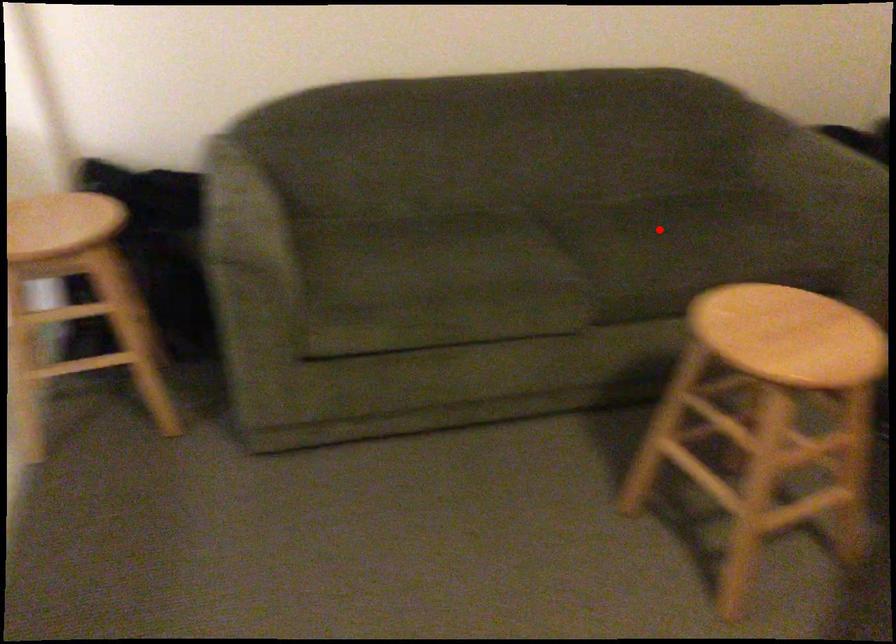
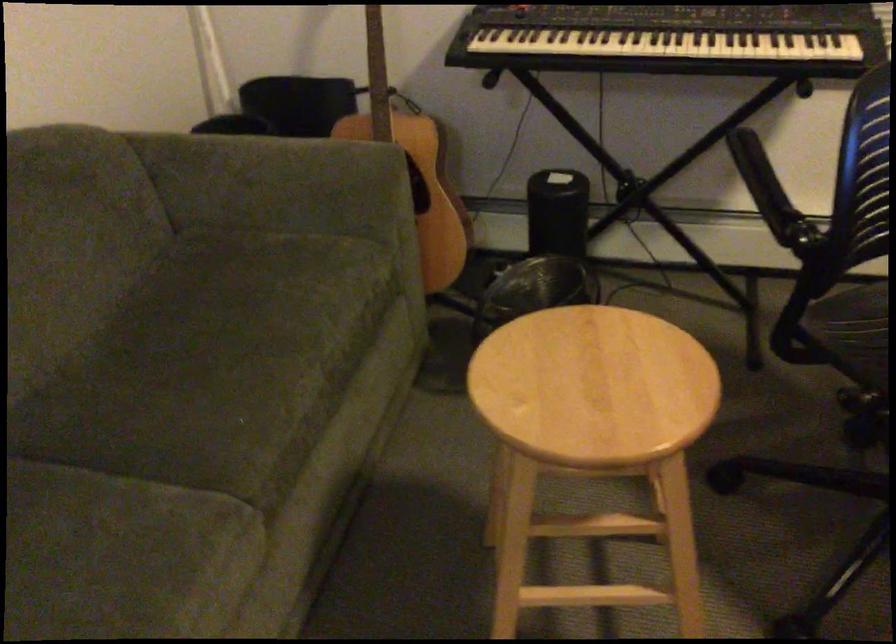
Question: I am providing you with two images of the same scene from different viewpoints. In image1, a red point is highlighted. Considering the same 3D point in image2, which of the following is correct?

Choices:
 (A) It is closer
 (B) It is farther

Answer: (A)